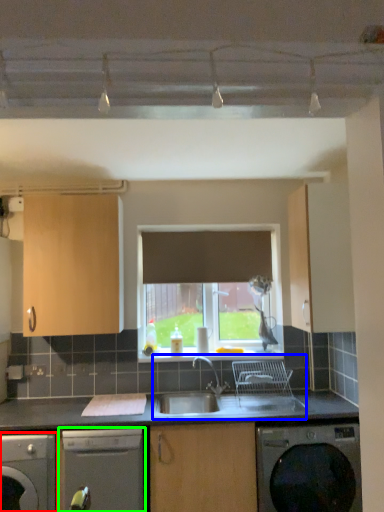
Question: Based on their relative distances, which object is nearer to dishwasher (highlighted by a red box)? Choose from sink (highlighted by a blue box) and dishwasher (highlighted by a green box).

Choices:
 (A) sink
 (B) dishwasher

Answer: (B)